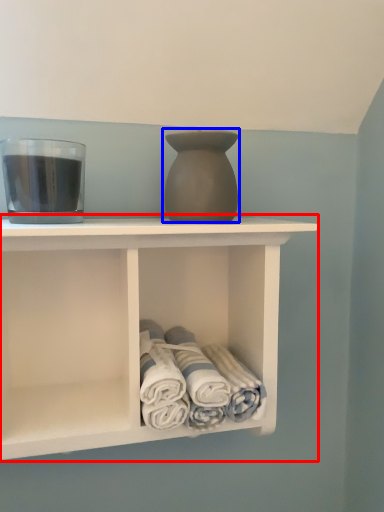
Question: Which object is further to the camera taking this photo, shelf (highlighted by a red box) or vase (highlighted by a blue box)?

Choices:
 (A) shelf
 (B) vase

Answer: (B)